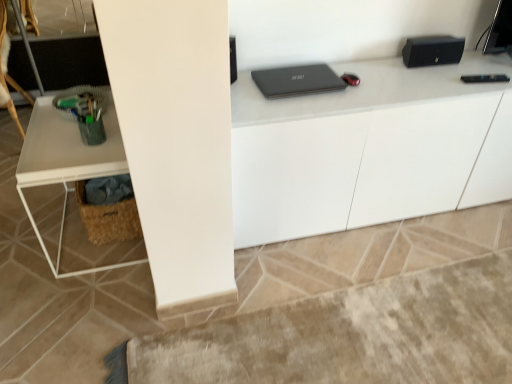
Question: In the image, is woven brown basket at lower left positioned in front of or behind wooden swivel chair at left?

Choices:
 (A) front
 (B) behind

Answer: (A)

Question: Is woven brown basket at lower left inside or outside of wooden swivel chair at left?

Choices:
 (A) outside
 (B) inside

Answer: (A)

Question: Considering the real-world distances, which object is closest to the woven brown basket at lower left?

Choices:
 (A) white matte table at left, which is the 1th computer desk from left to right
 (B) wooden swivel chair at left
 (C) matte black laptop at center
 (D) white glossy cabinet at upper center, which appears as the first computer desk when viewed from the right

Answer: (A)

Question: Estimate the real-world distances between objects in this image. Which object is farther from the woven brown basket at lower left?

Choices:
 (A) white matte table at left, the second computer desk when ordered from right to left
 (B) matte black laptop at center
 (C) wooden swivel chair at left
 (D) white glossy cabinet at upper center, the second computer desk when ordered from left to right

Answer: (C)